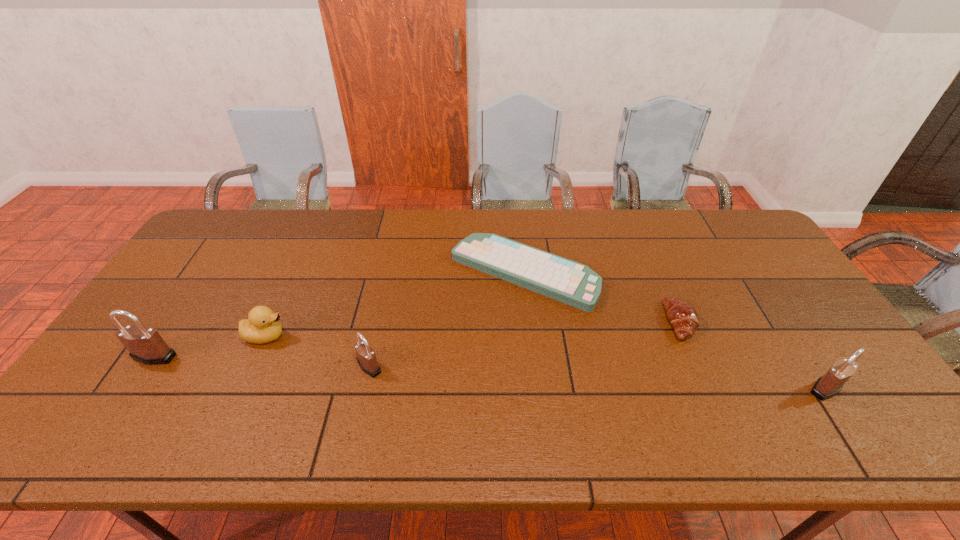
Where is `free spot that satisfies the following two spatial constraints: 1. on the face of the second object from left to right; 2. on the back side of the rightmost padlock`? The height and width of the screenshot is (540, 960). free spot that satisfies the following two spatial constraints: 1. on the face of the second object from left to right; 2. on the back side of the rightmost padlock is located at coordinates (242, 388).

At what (x,y) coordinates should I click in order to perform the action: click on free space that satisfies the following two spatial constraints: 1. on the front side of the shortest padlock; 2. on the left side of the leftmost padlock. Please return your answer as a coordinate pair (x, y). Image resolution: width=960 pixels, height=540 pixels. Looking at the image, I should click on (148, 367).

Identify the location of free space that satisfies the following two spatial constraints: 1. on the face of the shortest padlock; 2. on the right side of the duckling. Image resolution: width=960 pixels, height=540 pixels. coord(252,367).